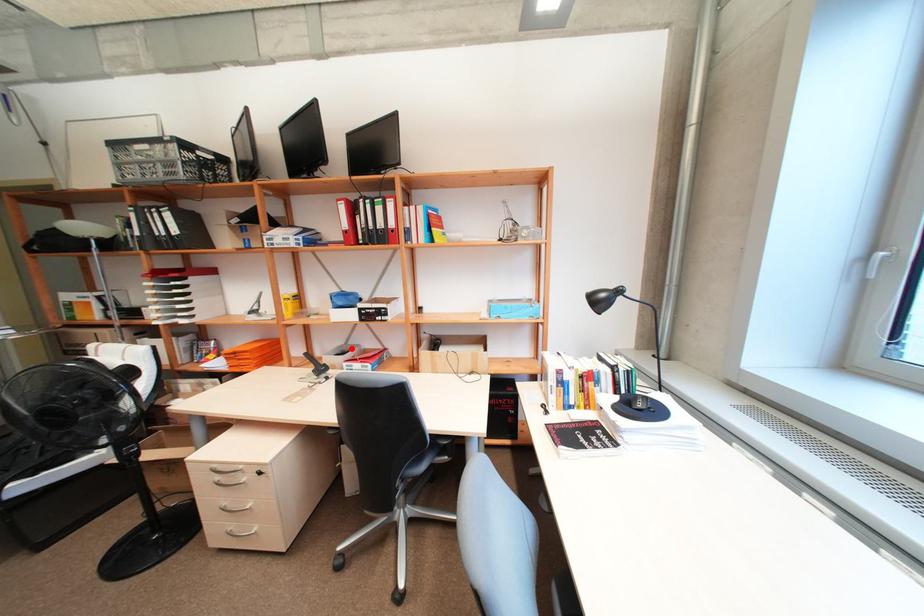
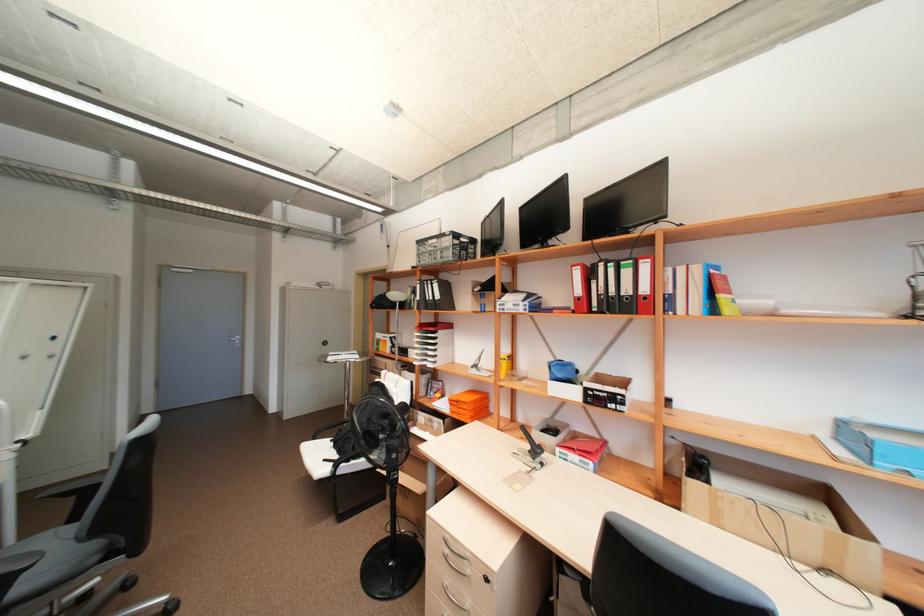
Question: A red point is marked in image1. In image2, is the corresponding 3D point closer to the camera or farther? Reply with the corresponding letter.

Choices:
 (A) The corresponding 3D point is closer.
 (B) The corresponding 3D point is farther.

Answer: (B)